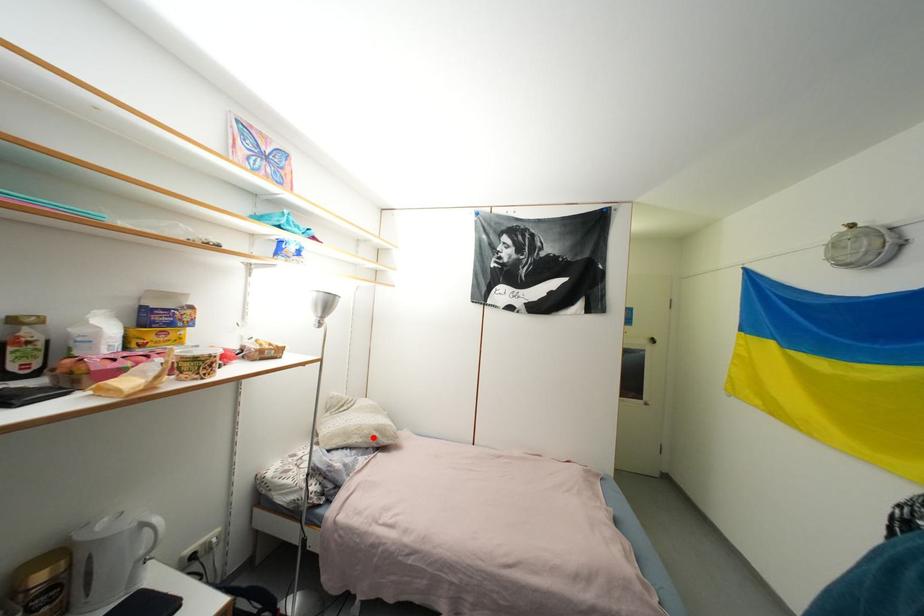
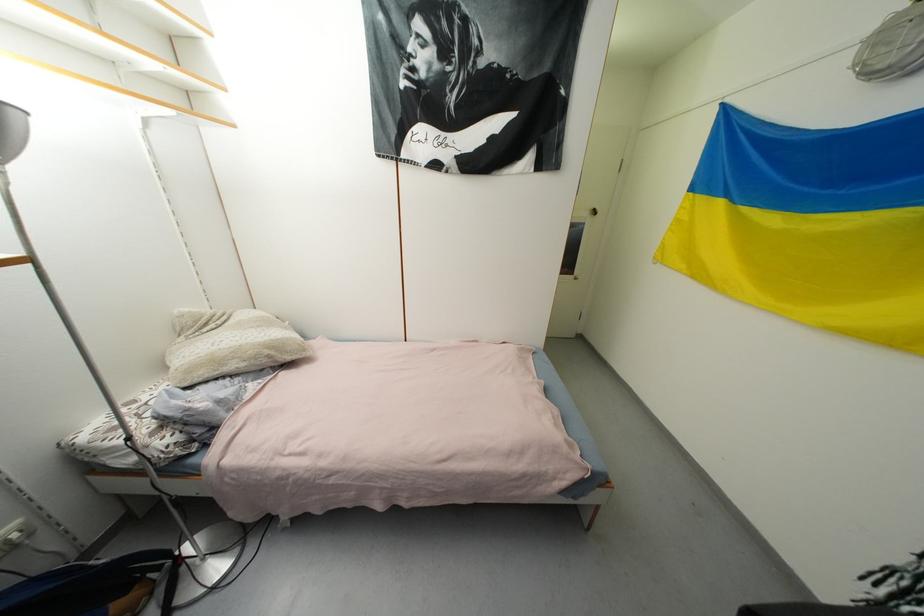
Question: I am providing you with two images of the same scene from different viewpoints. In image1, a red point is highlighted. Considering the same 3D point in image2, which of the following is correct?

Choices:
 (A) It is closer
 (B) It is farther

Answer: (A)